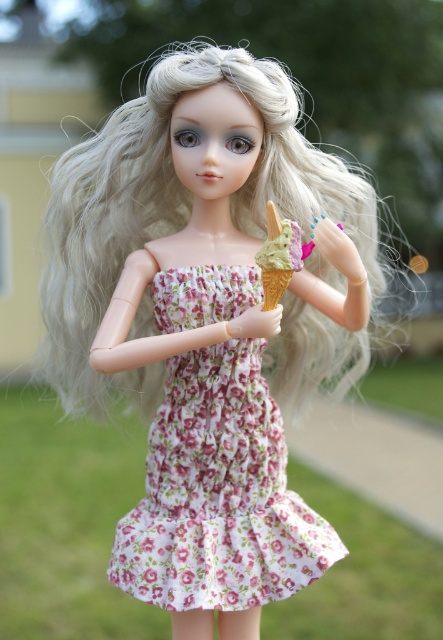
Does blonde silky hair at center have a greater height compared to green matte ice cream cone at center?

Indeed, blonde silky hair at center has a greater height compared to green matte ice cream cone at center.

How far apart are blonde silky hair at center and green matte ice cream cone at center?

blonde silky hair at center is 7.97 inches from green matte ice cream cone at center.

Who is more distant from viewer, (70, 161) or (267, 300)?

The point (70, 161) is behind.

Where is `blonde silky hair at center`? blonde silky hair at center is located at coordinates (174, 205).

Can you confirm if floral cotton dress at center is shorter than green matte ice cream cone at center?

Incorrect, floral cotton dress at center's height does not fall short of green matte ice cream cone at center's.

Does point (248, 536) lie in front of point (288, 280)?

No, it is not.

This screenshot has height=640, width=443. I want to click on floral cotton dress at center, so click(218, 493).

Is blonde silky hair at center positioned in front of floral cotton dress at center?

That is False.

What do you see at coordinates (174, 205) in the screenshot? This screenshot has width=443, height=640. I see `blonde silky hair at center` at bounding box center [174, 205].

Is point (156, 387) farther from viewer compared to point (116, 570)?

Yes, it is.

The width and height of the screenshot is (443, 640). Find the location of `blonde silky hair at center`. blonde silky hair at center is located at coordinates (174, 205).